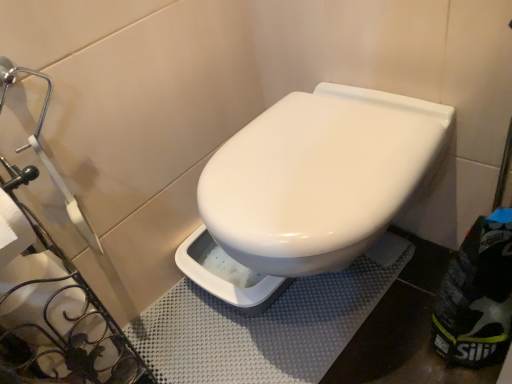
The height and width of the screenshot is (384, 512). I want to click on gray textured bath mat at center, so click(266, 325).

What do you see at coordinates (266, 325) in the screenshot? Image resolution: width=512 pixels, height=384 pixels. I see `gray textured bath mat at center` at bounding box center [266, 325].

Find the location of a particular element. The height and width of the screenshot is (384, 512). gray textured bath mat at center is located at coordinates (266, 325).